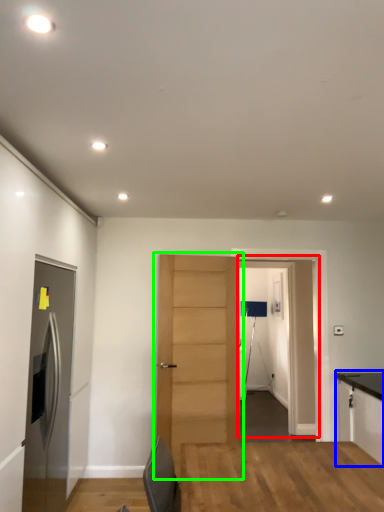
Question: Estimate the real-world distances between objects in this image. Which object is farther from glass door (highlighted by a red box), cabinetry (highlighted by a blue box) or door (highlighted by a green box)?

Choices:
 (A) cabinetry
 (B) door

Answer: (B)